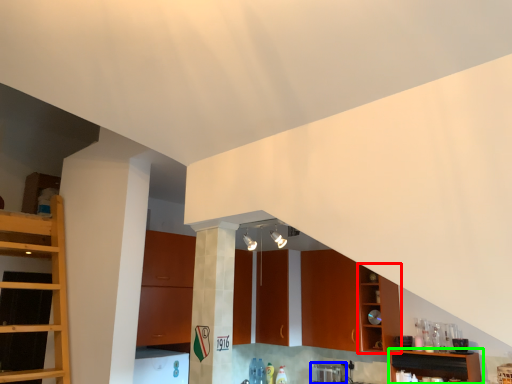
Question: Which object is positioned closest to cabinetry (highlighted by a red box)? Select from appliance (highlighted by a blue box) and shelf (highlighted by a green box).

Choices:
 (A) appliance
 (B) shelf

Answer: (B)